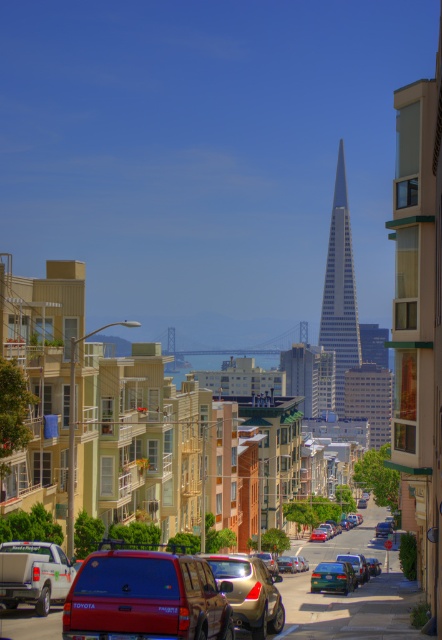
Question: Which of the following is the closest to the observer?

Choices:
 (A) (385, 532)
 (B) (213, 579)
 (C) (267, 579)

Answer: (B)

Question: Which point appears closest to the camera in this image?

Choices:
 (A) (380, 532)
 (B) (182, 572)
 (C) (316, 582)

Answer: (B)

Question: Which point is farther from the camera taking this photo?

Choices:
 (A) (14, 579)
 (B) (267, 625)
 (C) (163, 582)

Answer: (A)

Question: Is metallic red van at center wider than green matte pickup truck at lower left?

Choices:
 (A) yes
 (B) no

Answer: (A)

Question: Is glassy steel skyscraper at center above metallic silver sedan at center?

Choices:
 (A) no
 (B) yes

Answer: (B)

Question: Can you confirm if green matte pickup truck at lower left is thinner than metallic silver car at center?

Choices:
 (A) yes
 (B) no

Answer: (A)